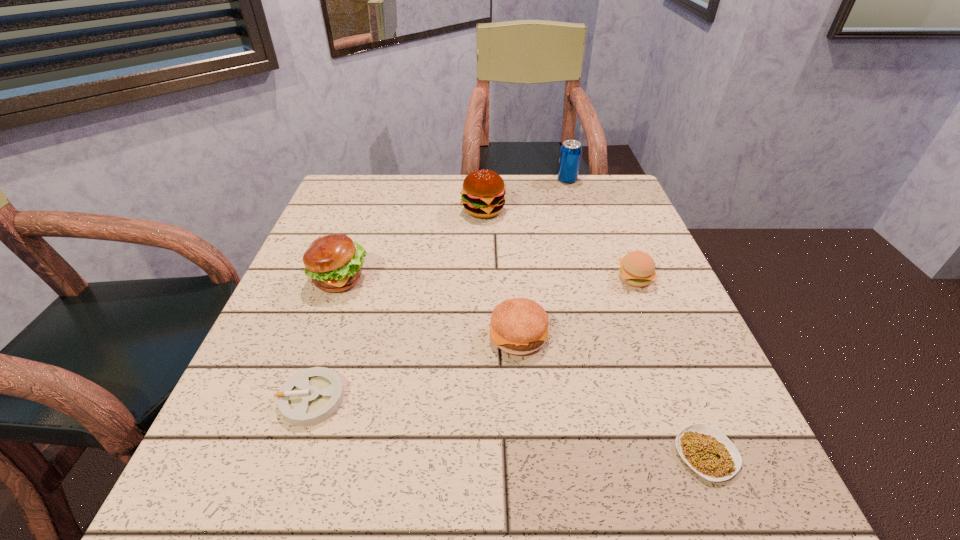
Locate an element on the screen. The width and height of the screenshot is (960, 540). the third object from right to left is located at coordinates (570, 153).

The height and width of the screenshot is (540, 960). I want to click on the farthest object, so click(570, 153).

The image size is (960, 540). What are the coordinates of `the sixth nearest object` in the screenshot? It's located at pos(483,195).

Find the location of a particular element. This screenshot has width=960, height=540. the leftmost hamburger is located at coordinates (334, 263).

Image resolution: width=960 pixels, height=540 pixels. In order to click on the nearest hamburger in this screenshot , I will do `click(519, 326)`.

Where is `the rightmost hamburger`? This screenshot has height=540, width=960. the rightmost hamburger is located at coordinates (637, 268).

You are a GUI agent. You are given a task and a screenshot of the screen. Output one action in this format:
    pyautogui.click(x=<x>, y=<y>)
    Task: Click on the second shortest object
    The width and height of the screenshot is (960, 540).
    Given the screenshot: What is the action you would take?
    (x=311, y=396)

The width and height of the screenshot is (960, 540). In order to click on the shortest object in this screenshot , I will do `click(706, 450)`.

Find the location of a particular element. The width and height of the screenshot is (960, 540). free space located on the left of the fifth object from left to right is located at coordinates (419, 180).

The height and width of the screenshot is (540, 960). Identify the location of vacant space located 0.290m on the front of the farthest hamburger. (485, 303).